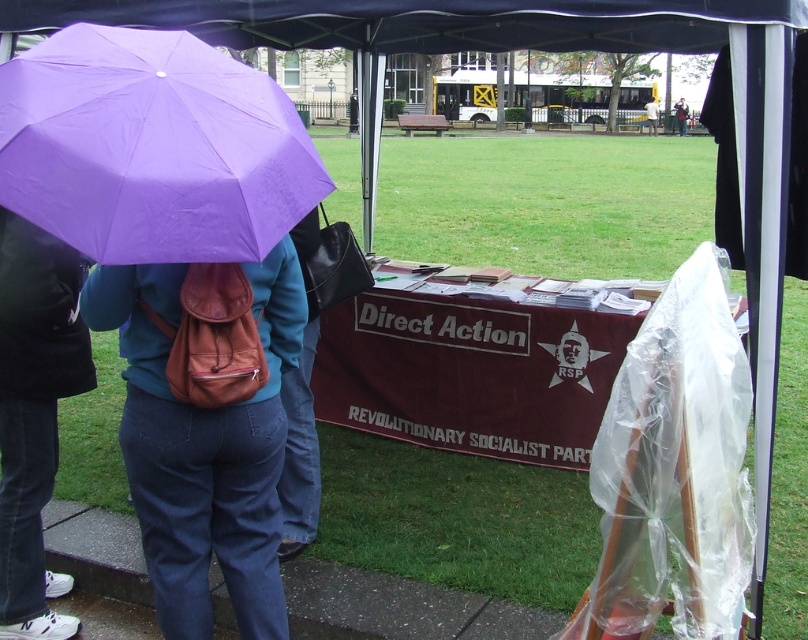
Is the position of dark blue jeans at lower left more distant than that of white plastic bag at center?

No, dark blue jeans at lower left is closer to the viewer.

Does dark blue jeans at lower left have a lesser height compared to white plastic bag at center?

Indeed, dark blue jeans at lower left has a lesser height compared to white plastic bag at center.

You are a GUI agent. You are given a task and a screenshot of the screen. Output one action in this format:
    pyautogui.click(x=<x>, y=<y>)
    Task: Click on the dark blue jeans at lower left
    This screenshot has height=640, width=808.
    Given the screenshot: What is the action you would take?
    pyautogui.click(x=34, y=413)

This screenshot has width=808, height=640. Identify the location of dark blue jeans at lower left. (34, 413).

Does purple matte umbrella at upper left have a greater width compared to white plastic bag at center?

Indeed, purple matte umbrella at upper left has a greater width compared to white plastic bag at center.

Can you confirm if purple matte umbrella at upper left is thinner than white plastic bag at center?

Result: In fact, purple matte umbrella at upper left might be wider than white plastic bag at center.

At what (x,y) coordinates should I click in order to perform the action: click on purple matte umbrella at upper left. Please return your answer as a coordinate pair (x, y). The image size is (808, 640). Looking at the image, I should click on (152, 147).

Identify the location of purple matte umbrella at upper left. The width and height of the screenshot is (808, 640). (152, 147).

Who is lower down, purple matte umbrella at upper left or light brown leather jacket at upper center?

purple matte umbrella at upper left

Is point (23, 204) positioned behind point (684, 104)?

No, (23, 204) is in front of (684, 104).

The image size is (808, 640). What do you see at coordinates (152, 147) in the screenshot?
I see `purple matte umbrella at upper left` at bounding box center [152, 147].

Where is `purple matte umbrella at upper left`? purple matte umbrella at upper left is located at coordinates (152, 147).